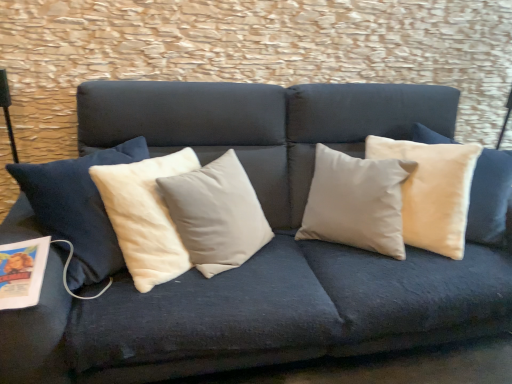
Question: From a real-world perspective, is beige velvet pillow at upper right physically located above or below matte paper magazine at lower left?

Choices:
 (A) below
 (B) above

Answer: (B)

Question: Do you think beige velvet pillow at upper right is within matte paper magazine at lower left, or outside of it?

Choices:
 (A) inside
 (B) outside

Answer: (B)

Question: Considering the positions of point (461, 193) and point (19, 274), is point (461, 193) closer or farther from the camera than point (19, 274)?

Choices:
 (A) closer
 (B) farther

Answer: (B)

Question: Is matte paper magazine at lower left spatially inside beige velvet pillow at upper right, or outside of it?

Choices:
 (A) inside
 (B) outside

Answer: (B)

Question: From a real-world perspective, relative to beige velvet pillow at upper right, is matte paper magazine at lower left vertically above or below?

Choices:
 (A) below
 (B) above

Answer: (A)

Question: From the image's perspective, is matte paper magazine at lower left positioned above or below beige velvet pillow at upper right?

Choices:
 (A) above
 (B) below

Answer: (B)

Question: In the image, is matte paper magazine at lower left on the left side or the right side of beige velvet pillow at upper right?

Choices:
 (A) right
 (B) left

Answer: (B)